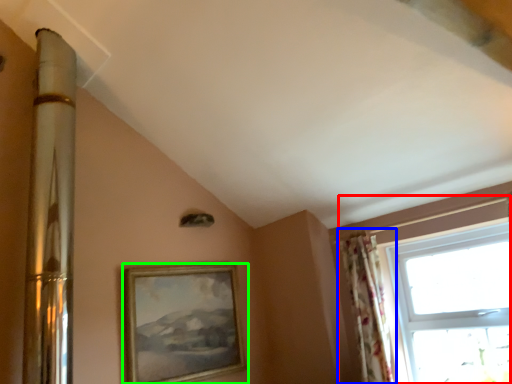
Question: Which is farther away from window (highlighted by a red box)? curtain (highlighted by a blue box) or picture frame (highlighted by a green box)?

Choices:
 (A) curtain
 (B) picture frame

Answer: (B)